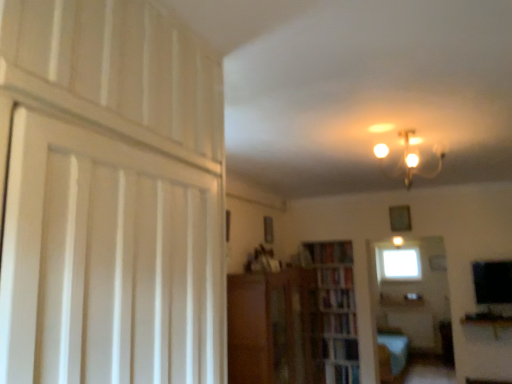
At what (x,y) coordinates should I click in order to perform the action: click on empty space that is ontop of white wood door at left (from a real-world perspective). Please return your answer as a coordinate pair (x, y). The height and width of the screenshot is (384, 512). Looking at the image, I should click on (140, 149).